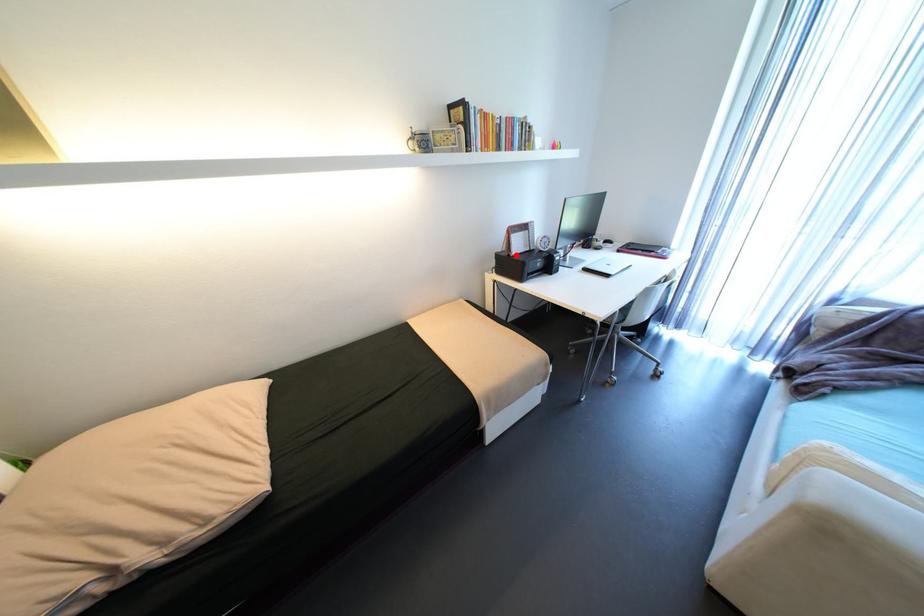
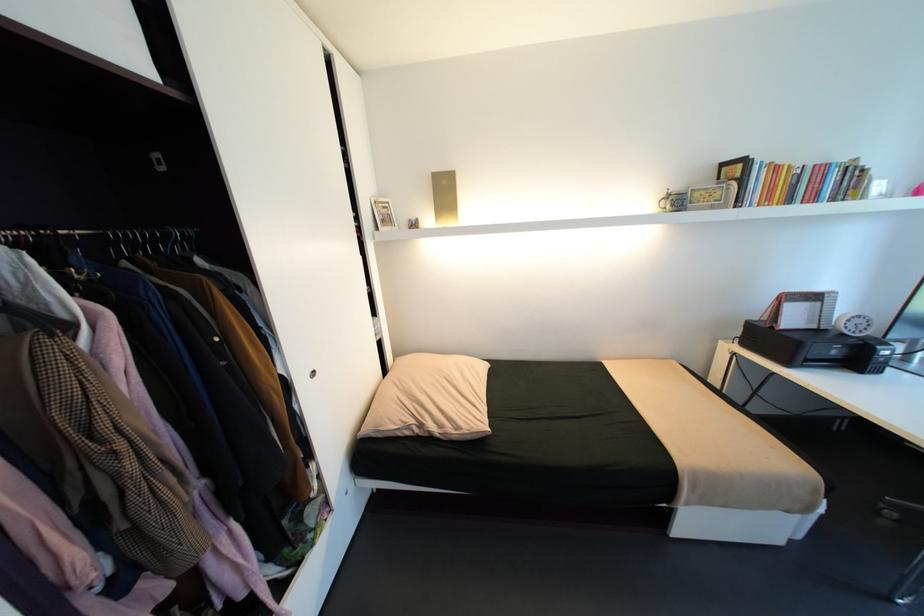
Question: I am providing you with two images of the same scene from different viewpoints. A red point is shown in image1. For the corresponding object point in image2, is it positioned nearer or farther from the camera?

Choices:
 (A) Nearer
 (B) Farther

Answer: (B)